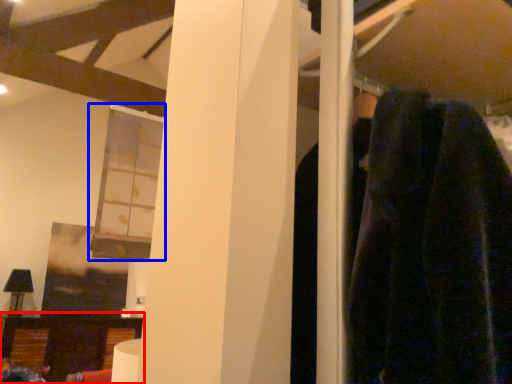
Question: Which point is closer to the camera, furniture (highlighted by a red box) or window (highlighted by a blue box)?

Choices:
 (A) furniture
 (B) window

Answer: (B)